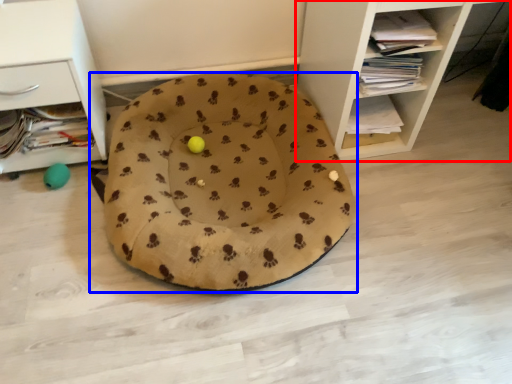
Question: Which point is closer to the camera, shelf (highlighted by a red box) or dog bed (highlighted by a blue box)?

Choices:
 (A) shelf
 (B) dog bed

Answer: (A)